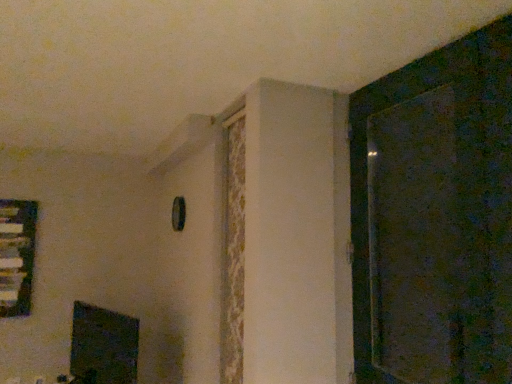
Describe the element at coordinates (17, 255) in the screenshot. This screenshot has height=384, width=512. I see `clear glass window at left` at that location.

In order to face black glossy fireplace at lower left, should I rotate leftwards or rightwards?

Rotate left and turn 20.028 degrees.

The width and height of the screenshot is (512, 384). In order to click on dark textured screen door at right in this screenshot , I will do `click(416, 239)`.

In the scene shown: From a real-world perspective, does clear glass window at left sit lower than dark textured screen door at right?

Indeed, from a real-world perspective, clear glass window at left is positioned beneath dark textured screen door at right.

From the image's perspective, is clear glass window at left above or below dark textured screen door at right?

Based on their image positions, clear glass window at left is located beneath dark textured screen door at right.

Is clear glass window at left spatially inside dark textured screen door at right, or outside of it?

clear glass window at left is not inside dark textured screen door at right, it's outside.

Which is in front, point (24, 233) or point (385, 169)?

Positioned in front is point (385, 169).

Is dark textured screen door at right in front of or behind clear glass window at left in the image?

In the image, dark textured screen door at right appears in front of clear glass window at left.

The height and width of the screenshot is (384, 512). Identify the location of window below the dark textured screen door at right (from a real-world perspective). (17, 255).

Is point (453, 350) less distant than point (25, 284)?

Yes, it is.

From the image's perspective, is dark textured screen door at right positioned above or below clear glass window at left?

dark textured screen door at right is situated higher than clear glass window at left in the image.

Is black glossy fireplace at lower left touching clear glass window at left?

black glossy fireplace at lower left is not next to clear glass window at left, and they're not touching.

Which of these two, black glossy fireplace at lower left or clear glass window at left, stands shorter?

Standing shorter between the two is black glossy fireplace at lower left.

Is point (135, 344) closer or farther from the camera than point (23, 250)?

Point (135, 344) is farther from the camera than point (23, 250).

Find the location of a particular element. The image size is (512, 384). window above the black glossy fireplace at lower left (from a real-world perspective) is located at coordinates (17, 255).

Does clear glass window at left turn towards black glossy fireplace at lower left?

No, clear glass window at left is not oriented towards black glossy fireplace at lower left.

How much distance is there between clear glass window at left and black glossy fireplace at lower left?

A distance of 29.28 inches exists between clear glass window at left and black glossy fireplace at lower left.

Looking at this image, is clear glass window at left with black glossy fireplace at lower left?

No, clear glass window at left is not next to black glossy fireplace at lower left.

Is clear glass window at left positioned in front of black glossy fireplace at lower left?

No, it is behind black glossy fireplace at lower left.

Between point (74, 349) and point (382, 261), which one is positioned in front?

The point (382, 261) is in front.

Who is bigger, black glossy fireplace at lower left or dark textured screen door at right?

dark textured screen door at right is bigger.

Is black glossy fireplace at lower left facing towards dark textured screen door at right?

No, black glossy fireplace at lower left does not turn towards dark textured screen door at right.

Is black glossy fireplace at lower left positioned beyond the bounds of dark textured screen door at right?

Yes, black glossy fireplace at lower left is not within dark textured screen door at right.

Is dark textured screen door at right positioned behind black glossy fireplace at lower left?

No, it is not.

Between point (456, 287) and point (99, 337), which one is positioned in front?

Point (456, 287)

Are dark textured screen door at right and black glossy fireplace at lower left located far from each other?

Absolutely, dark textured screen door at right is distant from black glossy fireplace at lower left.

Looking at this image, from a real-world perspective, which object rests below the other?

black glossy fireplace at lower left, from a real-world perspective.

The width and height of the screenshot is (512, 384). What are the coordinates of `screen door in front of the clear glass window at left` in the screenshot? It's located at (416, 239).

Locate an element on the screen. Image resolution: width=512 pixels, height=384 pixels. window below the dark textured screen door at right (from the image's perspective) is located at coordinates (17, 255).

Considering their positions, is black glossy fireplace at lower left positioned closer to dark textured screen door at right than clear glass window at left?

black glossy fireplace at lower left lies closer to dark textured screen door at right than the other object.

From the image, which object appears to be nearer to dark textured screen door at right, clear glass window at left or black glossy fireplace at lower left?

Among the two, black glossy fireplace at lower left is located nearer to dark textured screen door at right.

Estimate the real-world distances between objects in this image. Which object is closer to clear glass window at left, dark textured screen door at right or black glossy fireplace at lower left?

Based on the image, black glossy fireplace at lower left appears to be nearer to clear glass window at left.

Considering their positions, is black glossy fireplace at lower left positioned further to clear glass window at left than dark textured screen door at right?

dark textured screen door at right is further to clear glass window at left.

Estimate the real-world distances between objects in this image. Which object is further from black glossy fireplace at lower left, dark textured screen door at right or clear glass window at left?

dark textured screen door at right lies further to black glossy fireplace at lower left than the other object.

When comparing their distances from black glossy fireplace at lower left, does clear glass window at left or dark textured screen door at right seem closer?

clear glass window at left is positioned closer to the anchor black glossy fireplace at lower left.

This screenshot has width=512, height=384. In order to click on fireplace situated between clear glass window at left and dark textured screen door at right from left to right in this screenshot , I will do click(103, 346).